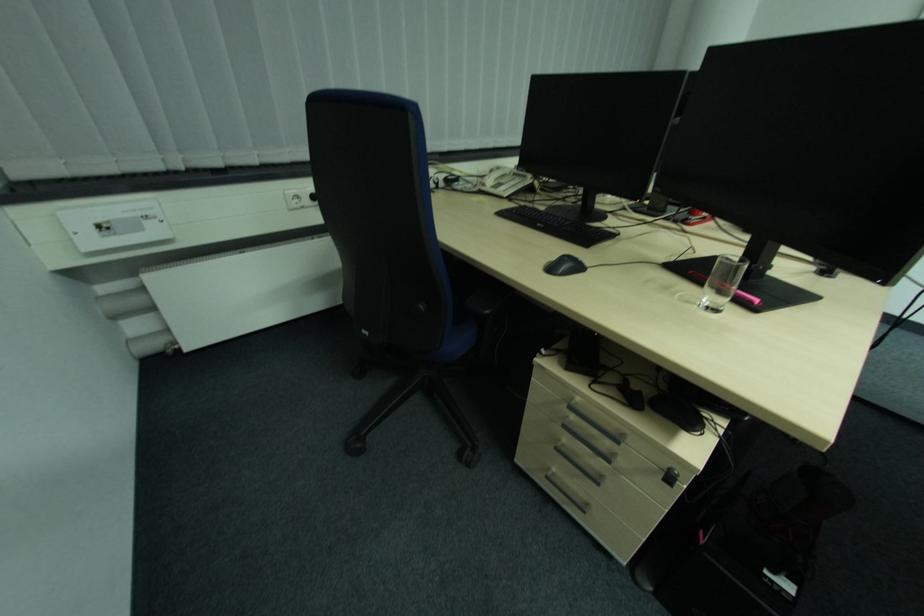
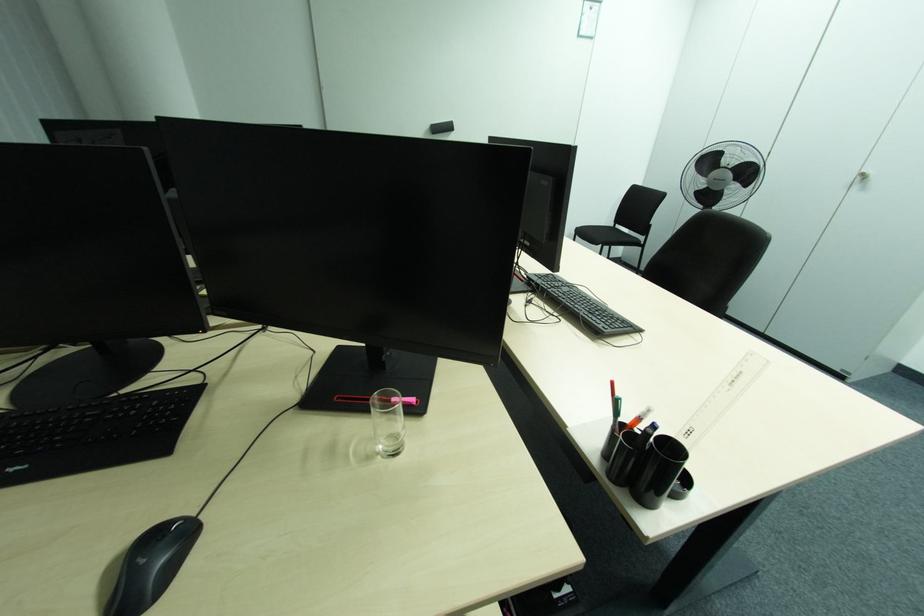
Based on the continuous images, in which direction is the camera rotating?

The rotation direction of the camera is right-down.